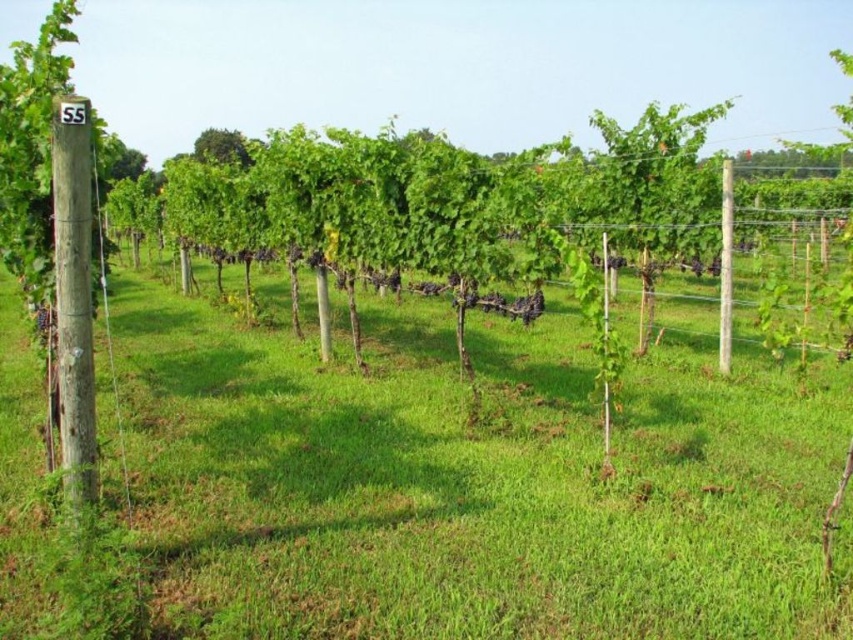
Which is in front, point (490, 403) or point (227, 132)?

Positioned in front is point (490, 403).

Who is lower down, green grass at center or green leafy tree at upper center?

green grass at center is lower down.

Is point (844, 506) in front of point (196, 148)?

Yes.

Where is `green grass at center`? This screenshot has width=853, height=640. green grass at center is located at coordinates (469, 486).

Consider the image. Does green grass at center have a greater width compared to white wood pole at center?

Indeed, green grass at center has a greater width compared to white wood pole at center.

Is green grass at center below white wood pole at center?

Indeed, green grass at center is positioned under white wood pole at center.

Between point (131, 442) and point (728, 173), which one is positioned behind?

Positioned behind is point (728, 173).

The width and height of the screenshot is (853, 640). In order to click on green grass at center in this screenshot , I will do `click(469, 486)`.

Can you confirm if green grass at center is shorter than brown wooden post at left?

Yes.

Can you confirm if green grass at center is positioned above brown wooden post at left?

Actually, green grass at center is below brown wooden post at left.

Is point (514, 358) positioned in front of point (70, 221)?

No, it is behind (70, 221).

The width and height of the screenshot is (853, 640). I want to click on green grass at center, so click(469, 486).